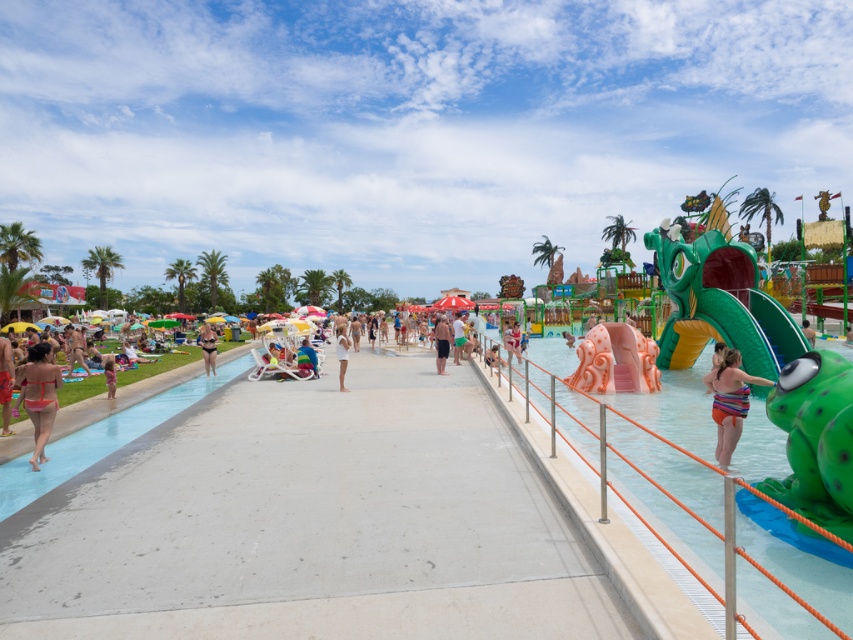
Is point (4, 420) closer to viewer compared to point (86, 374)?

That is True.

Is matte pink bikini at left positioned at the back of tan skin person at left?

That is False.

What do you see at coordinates (4, 384) in the screenshot? This screenshot has width=853, height=640. I see `matte pink bikini at left` at bounding box center [4, 384].

You are a GUI agent. You are given a task and a screenshot of the screen. Output one action in this format:
    pyautogui.click(x=<x>, y=<y>)
    Task: Click on the matte pink bikini at left
    
    Given the screenshot: What is the action you would take?
    pyautogui.click(x=4, y=384)

Does striped fabric bikini at right come in front of green rubber person at center?

Yes, striped fabric bikini at right is closer to the viewer.

Is point (718, 406) closer to camera compared to point (813, 333)?

Yes, it is.

Identify the location of striped fabric bikini at right. (729, 401).

Who is taller, pink rubber slide at center-right or matte black bikini at center?

pink rubber slide at center-right

Which is more to the left, pink rubber slide at center-right or matte black bikini at center?

matte black bikini at center is more to the left.

Does point (595, 376) lie behind point (210, 364)?

No, (595, 376) is in front of (210, 364).

Where is `pink rubber slide at center-right`? The height and width of the screenshot is (640, 853). pink rubber slide at center-right is located at coordinates (614, 360).